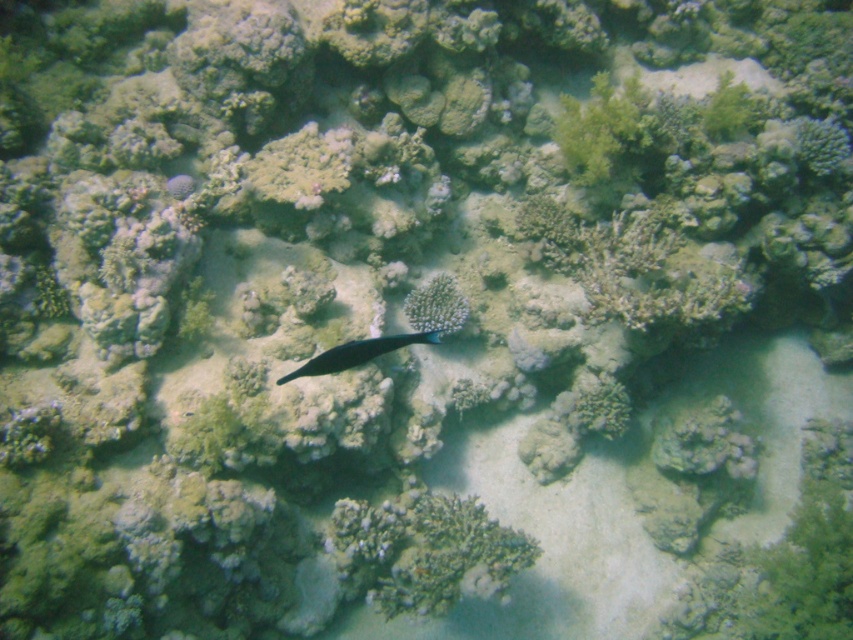
You are a scuba diver with a 2.5 meter long measuring tape. You are underwater and see the white porous coral at center. Can you determine if the coral is within reach of your tape measure?

The white porous coral at center is 3.17 meters away from viewer, so the coral is beyond the 2.5 meter length of the measuring tape and cannot be reached.

Looking at this image, you are a marine biologist studying the coral reef. You observe the white porous coral at center and the shiny blue fish at center. Which object has a greater width?

The shiny blue fish at center has a greater width than the white porous coral at center.